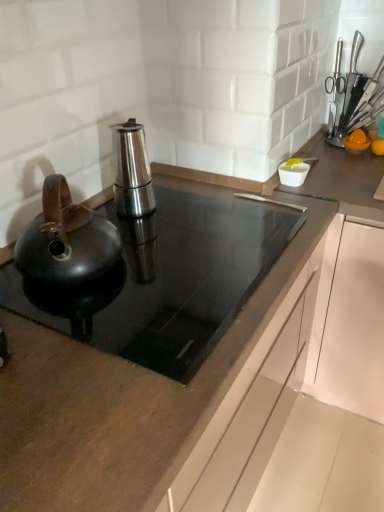
In order to click on free space to the back side of stainless steel espresso maker at center, which is the 1th kitchen appliance in back-to-front order in this screenshot , I will do `click(168, 183)`.